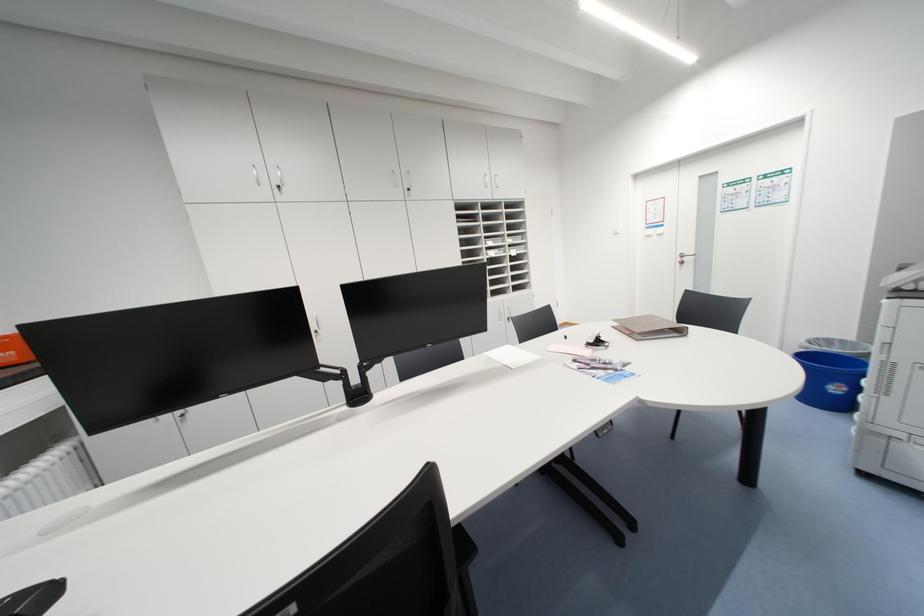
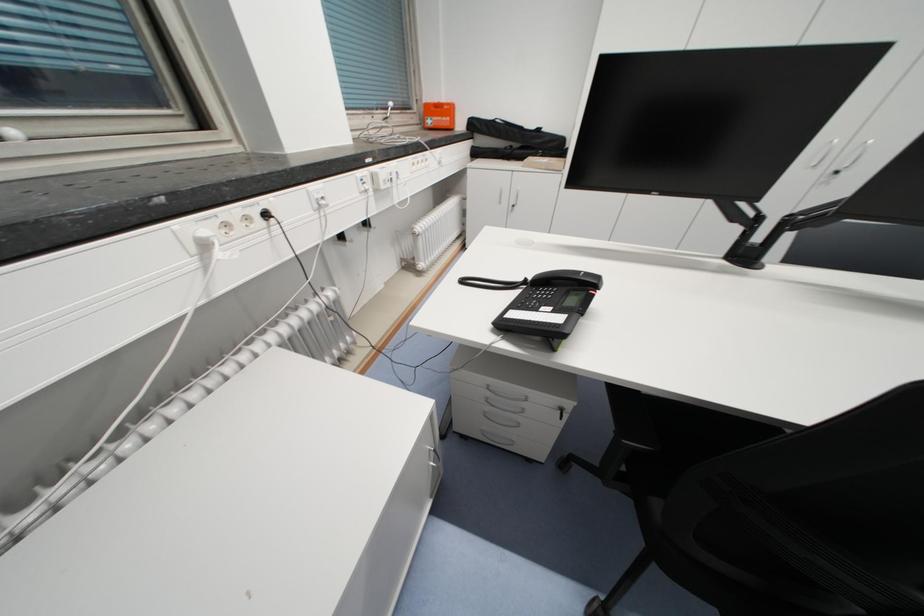
First-person continuous shooting, in which direction is the camera rotating?

The camera rotated toward left-down.